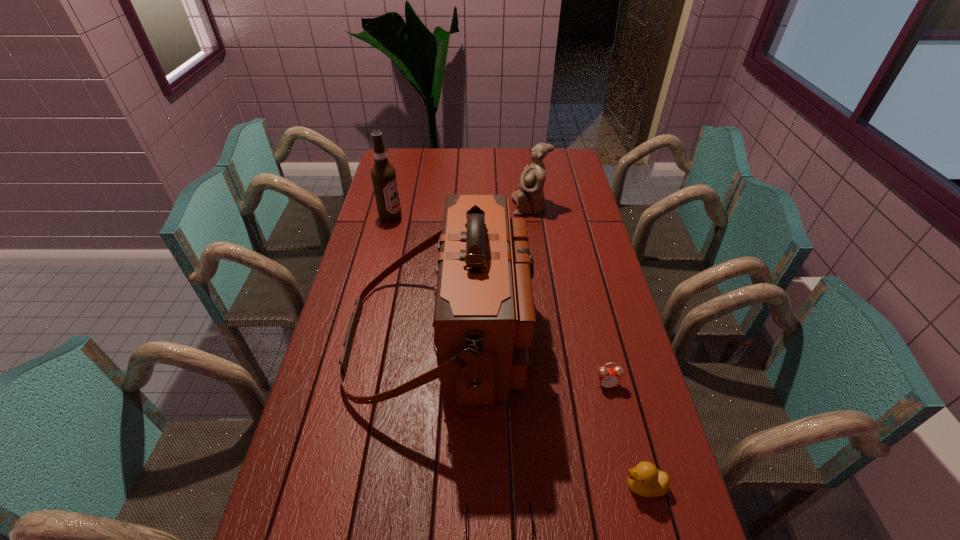
This screenshot has width=960, height=540. In the image, there is a desktop. What are the coordinates of `free space at the right edge` in the screenshot? It's located at (578, 218).

In order to click on free space between the fifth farthest object and the alarm clock in this screenshot , I will do `click(625, 435)`.

The height and width of the screenshot is (540, 960). What are the coordinates of `free space between the tallest object and the second tallest object` in the screenshot? It's located at (416, 277).

You are a GUI agent. You are given a task and a screenshot of the screen. Output one action in this format:
    pyautogui.click(x=<x>, y=<y>)
    Task: Click on the vacant region between the duckling and the alarm clock
    Image resolution: width=960 pixels, height=540 pixels.
    Given the screenshot: What is the action you would take?
    pyautogui.click(x=625, y=435)

Select which object appears as the fifth closest to the alarm clock. Please provide its 2D coordinates. Your answer should be formatted as a tuple, i.e. [(x, y)], where the tuple contains the x and y coordinates of a point satisfying the conditions above.

[(383, 174)]

Locate which object ranks fourth in proximity to the sunglasses. Please provide its 2D coordinates. Your answer should be formatted as a tuple, i.e. [(x, y)], where the tuple contains the x and y coordinates of a point satisfying the conditions above.

[(383, 174)]